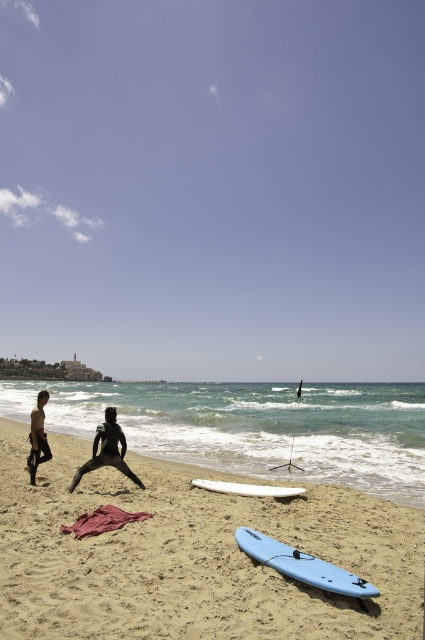
This screenshot has height=640, width=425. Describe the element at coordinates (192, 556) in the screenshot. I see `smooth sand at center` at that location.

Does smooth sand at center lie in front of light blue plastic surfboard at lower center?

Yes, smooth sand at center is closer to the viewer.

Between point (198, 588) and point (328, 582), which one is positioned in front?

Point (328, 582)

Identify the location of smooth sand at center. The width and height of the screenshot is (425, 640). [x=192, y=556].

Does point (39, 420) come closer to viewer compared to point (305, 492)?

No, it is behind (305, 492).

Between point (39, 433) and point (258, 490), which one is positioned in front?

Point (258, 490) is in front.

Measure the distance between point (47, 452) and camera.

A distance of 10.53 meters exists between point (47, 452) and camera.

You are a GUI agent. You are given a task and a screenshot of the screen. Output one action in this format:
    pyautogui.click(x=<x>, y=<y>)
    Task: Click on the matte black wetsuit at center
    
    Given the screenshot: What is the action you would take?
    pyautogui.click(x=37, y=436)

Does light blue plastic surfboard at lower center appear on the right side of matte black wetsuit at center?

Yes, light blue plastic surfboard at lower center is to the right of matte black wetsuit at center.

Is light blue plastic surfboard at lower center positioned behind matte black wetsuit at center?

No, it is not.

Which is behind, point (263, 536) or point (34, 412)?

Point (34, 412)

At what (x,y) coordinates should I click in order to perform the action: click on light blue plastic surfboard at lower center. Please return your answer as a coordinate pair (x, y). Looking at the image, I should click on (302, 564).